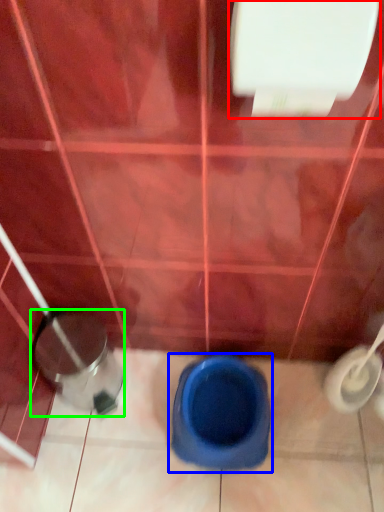
Question: Which is farther away from toilet paper (highlighted by a red box)? toilet (highlighted by a blue box) or potty (highlighted by a green box)?

Choices:
 (A) toilet
 (B) potty

Answer: (A)